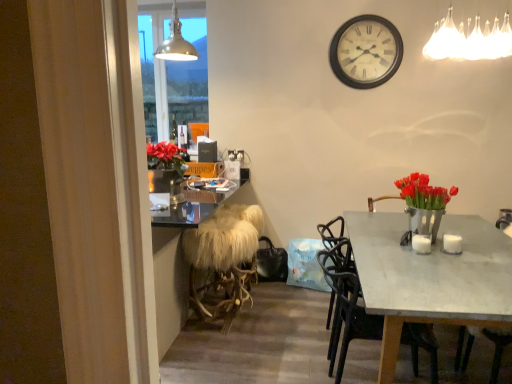
Question: Is white fabric chandelier at upper right, the 2th lamp viewed from the left, located outside metallic pendant light at upper center, the first lamp viewed from the back?

Choices:
 (A) no
 (B) yes

Answer: (B)

Question: Is metallic pendant light at upper center, acting as the 1th lamp starting from the left, located within white fabric chandelier at upper right, the 2th lamp viewed from the left?

Choices:
 (A) no
 (B) yes

Answer: (A)

Question: Is white fabric chandelier at upper right, acting as the first lamp starting from the right, looking in the opposite direction of metallic pendant light at upper center, the first lamp viewed from the back?

Choices:
 (A) yes
 (B) no

Answer: (B)

Question: Does white fabric chandelier at upper right, which is counted as the 1th lamp, starting from the front, turn towards metallic pendant light at upper center, the first lamp viewed from the back?

Choices:
 (A) yes
 (B) no

Answer: (A)

Question: Considering the relative sizes of white fabric chandelier at upper right, the 2th lamp viewed from the left, and metallic pendant light at upper center, the first lamp viewed from the back, in the image provided, is white fabric chandelier at upper right, the 2th lamp viewed from the left, shorter than metallic pendant light at upper center, the first lamp viewed from the back,?

Choices:
 (A) no
 (B) yes

Answer: (B)

Question: Considering their positions, is white glossy coffee cup at table right, which is the 1th coffee cup in right-to-left order, located in front of or behind matte gray table at center?

Choices:
 (A) behind
 (B) front

Answer: (A)

Question: From a real-world perspective, is white glossy coffee cup at table right, which is the 1th coffee cup in right-to-left order, positioned above or below matte gray table at center?

Choices:
 (A) above
 (B) below

Answer: (A)

Question: Looking at their shapes, would you say white glossy coffee cup at table right, which is the 1th coffee cup in right-to-left order, is wider or thinner than matte gray table at center?

Choices:
 (A) thin
 (B) wide

Answer: (A)

Question: From their relative heights in the image, would you say white glossy coffee cup at table right, the second coffee cup positioned from the left, is taller or shorter than matte gray table at center?

Choices:
 (A) short
 (B) tall

Answer: (A)

Question: From a real-world perspective, is metallic pendant light at upper center, the 2th lamp from the right, positioned above or below matte gray table at center?

Choices:
 (A) above
 (B) below

Answer: (A)

Question: Does point (186, 51) appear closer or farther from the camera than point (506, 296)?

Choices:
 (A) farther
 (B) closer

Answer: (A)

Question: Considering the positions of metallic pendant light at upper center, the 2th lamp from the right, and matte gray table at center in the image, is metallic pendant light at upper center, the 2th lamp from the right, bigger or smaller than matte gray table at center?

Choices:
 (A) big
 (B) small

Answer: (B)

Question: Would you say metallic pendant light at upper center, the 2th lamp from the right, is inside or outside matte gray table at center?

Choices:
 (A) inside
 (B) outside

Answer: (B)

Question: Is point (460, 301) positioned closer to the camera than point (378, 39)?

Choices:
 (A) farther
 (B) closer

Answer: (B)

Question: In the image, is matte gray table at center positioned in front of or behind white wooden clock at upper center?

Choices:
 (A) front
 (B) behind

Answer: (A)